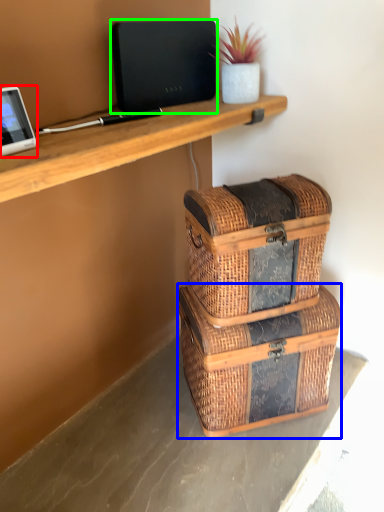
Question: Which is nearer to the tablet computer (highlighted by a red box)? storage box (highlighted by a blue box) or laptop (highlighted by a green box).

Choices:
 (A) storage box
 (B) laptop

Answer: (B)